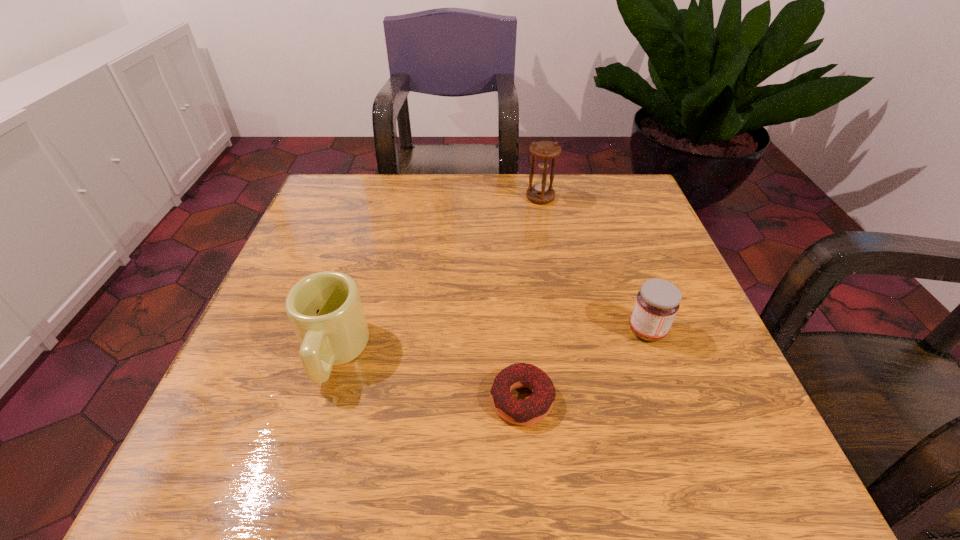
This screenshot has height=540, width=960. Identify the location of hourglass. (541, 192).

Where is `the farthest object`? the farthest object is located at coordinates 541,192.

I want to click on mug, so click(325, 310).

Where is `the third shortest object`? Image resolution: width=960 pixels, height=540 pixels. the third shortest object is located at coordinates (325, 310).

Find the location of a particular element. The image size is (960, 540). the second shortest object is located at coordinates (657, 302).

Where is `jam`? jam is located at coordinates (657, 302).

Where is `the shortest object`? the shortest object is located at coordinates (536, 407).

The width and height of the screenshot is (960, 540). I want to click on the third object from right to left, so click(536, 407).

This screenshot has height=540, width=960. I want to click on blank space located on the left of the tallest object, so click(373, 198).

This screenshot has width=960, height=540. Identify the location of vacant area situated on the left of the jam. (436, 330).